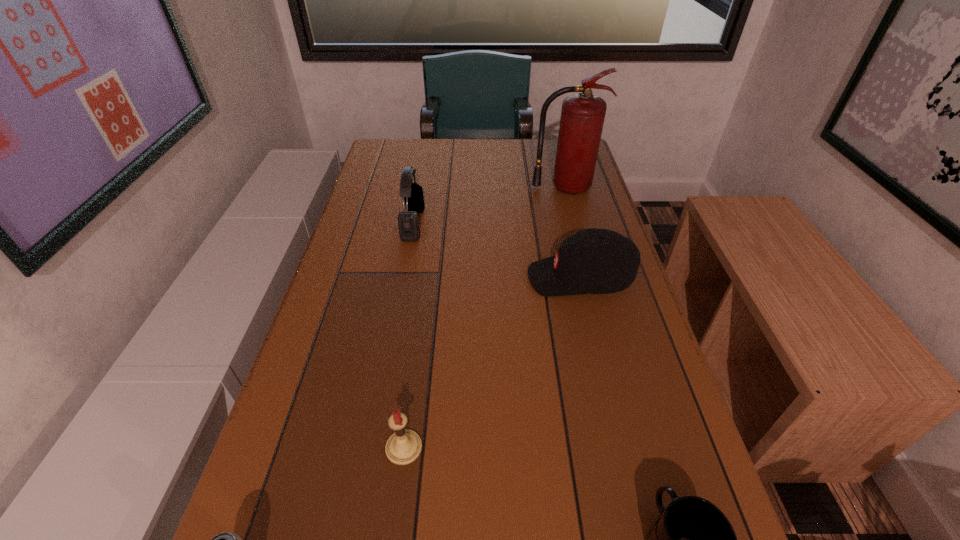
Locate an element on the screen. The width and height of the screenshot is (960, 540). empty space that is in between the second tallest object and the farthest object is located at coordinates (489, 206).

Find the location of `free spot between the candle and the baseball cap`. free spot between the candle and the baseball cap is located at coordinates (492, 363).

Locate an element on the screen. The height and width of the screenshot is (540, 960). the second closest object to the fourth farthest object is located at coordinates (692, 539).

This screenshot has height=540, width=960. What are the coordinates of `object that is the second closest to the fire extinguisher` in the screenshot? It's located at (408, 221).

In order to click on vacant space that satisfies the following two spatial constraints: 1. on the back side of the third nearest object; 2. on the headband of the headset in this screenshot , I will do `click(433, 224)`.

At what (x,y) coordinates should I click in order to perform the action: click on vacant space that satisfies the following two spatial constraints: 1. at the front of the fire extinguisher where the nozzle is aimed; 2. on the headband of the headset. Please return your answer as a coordinate pair (x, y). Image resolution: width=960 pixels, height=540 pixels. Looking at the image, I should click on (574, 224).